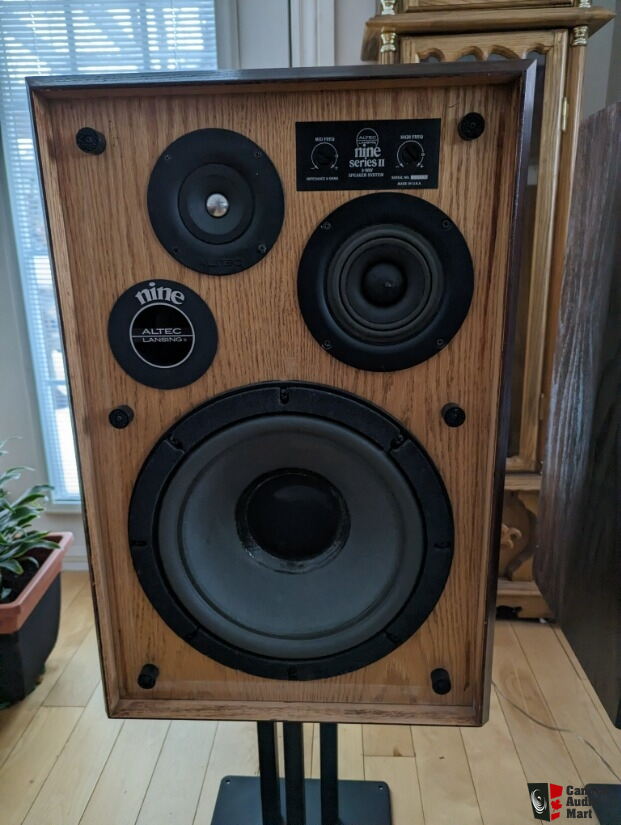
Locate an element on the screen. The width and height of the screenshot is (621, 825). medium brown wood frame for speaker is located at coordinates (465, 714), (128, 708), (76, 99), (482, 104).